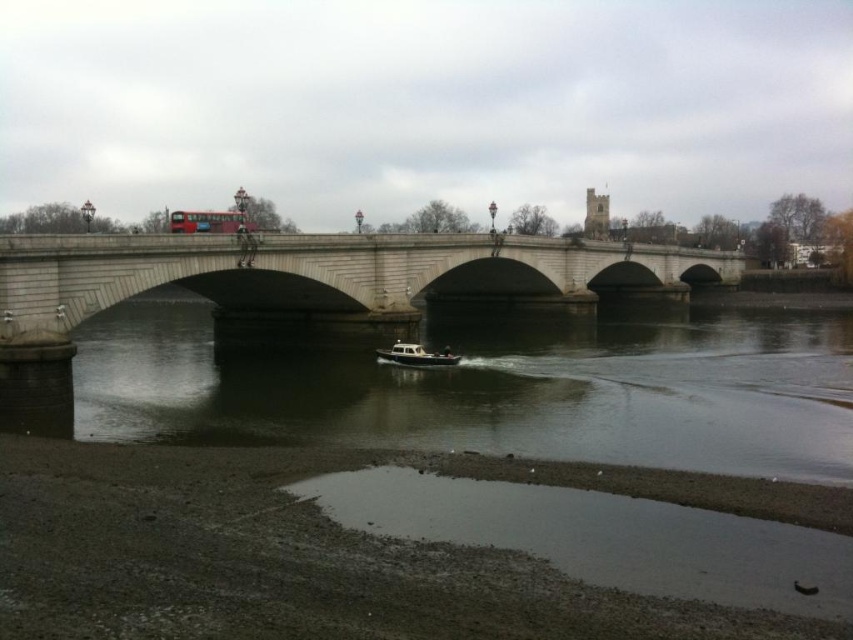
Between point (618, 259) and point (415, 349), which one is positioned behind?

The point (618, 259) is more distant.

Measure the distance from stone bridge at center to white matte boat at center.

The distance of stone bridge at center from white matte boat at center is 43.29 meters.

Between point (45, 300) and point (439, 360), which one is positioned in front?

Point (45, 300) is more forward.

The image size is (853, 640). I want to click on stone bridge at center, so click(x=321, y=275).

Who is shorter, stone bridge at center or red metallic bus at center?

With less height is stone bridge at center.

Is point (28, 289) in front of point (178, 228)?

Yes, it is in front of point (178, 228).

This screenshot has height=640, width=853. Identify the location of stone bridge at center. (321, 275).

Identify the location of stone bridge at center. (321, 275).

Is point (254, 227) positioned behind point (402, 348)?

That is True.

Between point (206, 228) and point (444, 362), which one is positioned behind?

Point (206, 228)

Is point (202, 216) closer to viewer compared to point (404, 364)?

No, (202, 216) is further to viewer.

Identify the location of red metallic bus at center. (210, 221).